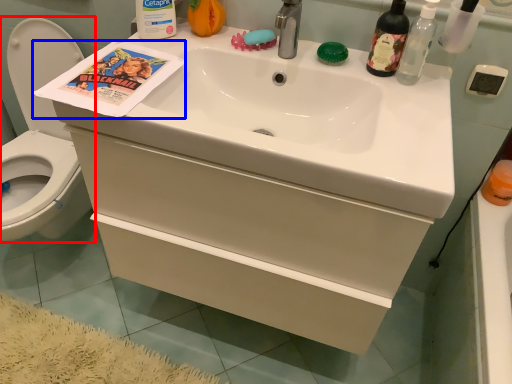
Question: Which object appears closest to the camera in this image, toilet (highlighted by a red box) or comic book (highlighted by a blue box)?

Choices:
 (A) toilet
 (B) comic book

Answer: (B)